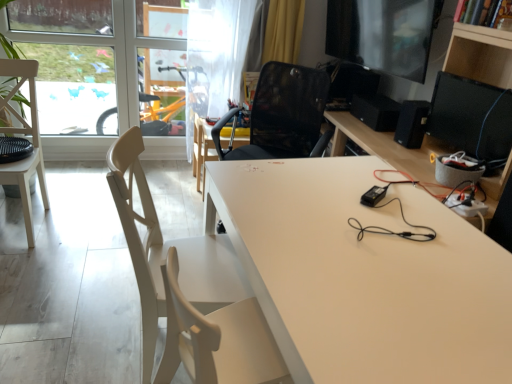
At what (x,y) coordinates should I click in order to perform the action: click on white matte table at center, the 2th table from the back. Please return your answer as a coordinate pair (x, y). Looking at the image, I should click on (364, 275).

Image resolution: width=512 pixels, height=384 pixels. Find the location of `white wood chair at left, positioned as the 2th chair in front-to-back order`. white wood chair at left, positioned as the 2th chair in front-to-back order is located at coordinates (25, 134).

Measure the distance between point (503, 131) and camera.

Point (503, 131) and camera are 6.45 feet apart from each other.

Describe the element at coordinates (383, 34) in the screenshot. I see `matte black monitor at upper right, acting as the first computer monitor starting from the top` at that location.

At what (x,y) coordinates should I click in order to perform the action: click on matte black monitor at upper right, the second computer monitor positioned from the bottom. Please return your answer as a coordinate pair (x, y). The image size is (512, 384). Looking at the image, I should click on (383, 34).

This screenshot has height=384, width=512. Find the location of `black matte speaker at right, positioned as the 1th speaker in front-to-back order`. black matte speaker at right, positioned as the 1th speaker in front-to-back order is located at coordinates (412, 123).

The width and height of the screenshot is (512, 384). In order to click on white wood chair at left, acting as the second chair starting from the back in this screenshot , I will do `click(167, 252)`.

What do you see at coordinates (202, 150) in the screenshot? I see `white matte table at center, the second table viewed from the front` at bounding box center [202, 150].

Describe the element at coordinates (74, 87) in the screenshot. I see `transparent glass window at upper left` at that location.

Where is `white matte table at center, the second table when ordered from top to bottom`? The width and height of the screenshot is (512, 384). white matte table at center, the second table when ordered from top to bottom is located at coordinates (364, 275).

From the image's perspective, which one is positioned lower, white matte table at center, which is the 1th table in left-to-right order, or transparent glass window at upper left?

From the image's view, white matte table at center, which is the 1th table in left-to-right order, is below.

Considering the relative positions of white matte table at center, the second table viewed from the front, and transparent glass window at upper left in the image provided, is white matte table at center, the second table viewed from the front, to the left or to the right of transparent glass window at upper left?

From the image, it's evident that white matte table at center, the second table viewed from the front, is to the right of transparent glass window at upper left.

Is point (202, 193) positioned before point (104, 78)?

Yes, it is in front of point (104, 78).

Based on the photo, from their relative heights in the image, would you say white matte table at center, the second table positioned from the right, is taller or shorter than transparent glass window at upper left?

Clearly, white matte table at center, the second table positioned from the right, is shorter compared to transparent glass window at upper left.

How different are the orientations of black glossy monitor at upper right, the 2th computer monitor from the top, and black matte speaker at right, the second speaker when ordered from back to front, in degrees?

They differ by 7.79 degrees in their facing directions.

Image resolution: width=512 pixels, height=384 pixels. I want to click on computer monitor on the right side of black matte speaker at right, the second speaker when ordered from back to front, so click(471, 116).

Are black glossy monitor at upper right, the first computer monitor when ordered from bottom to top, and black matte speaker at right, the second speaker when ordered from back to front, located far from each other?

No, black glossy monitor at upper right, the first computer monitor when ordered from bottom to top, is not far away from black matte speaker at right, the second speaker when ordered from back to front.

From a real-world perspective, is black glossy monitor at upper right, the 2th computer monitor from the top, physically located above or below black matte speaker at right, positioned as the 1th speaker in front-to-back order?

Clearly, from a real-world perspective, black glossy monitor at upper right, the 2th computer monitor from the top, is above black matte speaker at right, positioned as the 1th speaker in front-to-back order.

Considering the relative sizes of transparent glass window at upper left and white wood chair at left, the first chair positioned from the left, in the image provided, is transparent glass window at upper left bigger than white wood chair at left, the first chair positioned from the left,?

Incorrect, transparent glass window at upper left is not larger than white wood chair at left, the first chair positioned from the left.

From a real-world perspective, is transparent glass window at upper left physically below white wood chair at left, the 2th chair from the right?

No, from a real-world perspective, transparent glass window at upper left is not under white wood chair at left, the 2th chair from the right.

Is point (87, 80) closer to camera compared to point (12, 61)?

No, it is not.

Is there a large distance between transparent glass window at upper left and white wood chair at left, positioned as the 2th chair in front-to-back order?

No, transparent glass window at upper left is not far from white wood chair at left, positioned as the 2th chair in front-to-back order.

From a real-world perspective, is transparent glass window at upper left over matte black monitor at upper right, the second computer monitor positioned from the bottom?

Incorrect, from a real-world perspective, transparent glass window at upper left is lower than matte black monitor at upper right, the second computer monitor positioned from the bottom.

Considering the points (70, 108) and (371, 19), which point is behind, point (70, 108) or point (371, 19)?

The point (70, 108) is farther from the camera.

Is transparent glass window at upper left directly adjacent to matte black monitor at upper right, acting as the first computer monitor starting from the top?

No, transparent glass window at upper left is not with matte black monitor at upper right, acting as the first computer monitor starting from the top.

Is transparent glass window at upper left taller than matte black monitor at upper right, the second computer monitor positioned from the bottom?

Yes.

Between point (342, 30) and point (234, 216), which one is positioned in front?

The point (234, 216) is closer to the camera.

Does matte black monitor at upper right, the second computer monitor positioned from the bottom, have a smaller size compared to white matte table at center, the first table positioned from the front?

Yes.

From the image's perspective, which one is positioned lower, matte black monitor at upper right, the second computer monitor positioned from the bottom, or white matte table at center, which is the 1th table in bottom-to-top order?

white matte table at center, which is the 1th table in bottom-to-top order, appears lower in the image.

Is matte black monitor at upper right, acting as the first computer monitor starting from the top, spatially inside white matte table at center, the second table when ordered from top to bottom, or outside of it?

matte black monitor at upper right, acting as the first computer monitor starting from the top, exists outside the volume of white matte table at center, the second table when ordered from top to bottom.

Is black matte speaker at right, the second speaker when ordered from back to front, taller or shorter than transparent glass window at upper left?

Considering their sizes, black matte speaker at right, the second speaker when ordered from back to front, has less height than transparent glass window at upper left.

From the transparent glass window at upper left, count 2nd speaker to the right and point to it. Please provide its 2D coordinates.

[(412, 123)]

Is black matte speaker at right, positioned as the 1th speaker in front-to-back order, turned away from transparent glass window at upper left?

No, black matte speaker at right, positioned as the 1th speaker in front-to-back order, is not facing the opposite direction of transparent glass window at upper left.

From a real-world perspective, which is physically above, black matte speaker at right, positioned as the 1th speaker in front-to-back order, or transparent glass window at upper left?

black matte speaker at right, positioned as the 1th speaker in front-to-back order, is physically above.

Which is behind, point (123, 162) or point (387, 129)?

Point (387, 129)

From the image's perspective, relative to black matte speaker at upper right, the second speaker in the front-to-back sequence, is white wood chair at left, the second chair in the left-to-right sequence, above or below?

Clearly, from the image's perspective, white wood chair at left, the second chair in the left-to-right sequence, is below black matte speaker at upper right, the second speaker in the front-to-back sequence.

Measure the distance between white wood chair at left, the second chair in the left-to-right sequence, and black matte speaker at upper right, the second speaker in the front-to-back sequence.

white wood chair at left, the second chair in the left-to-right sequence, and black matte speaker at upper right, the second speaker in the front-to-back sequence, are 1.63 meters apart.

Is white wood chair at left, acting as the second chair starting from the back, behind black matte speaker at upper right, the second speaker in the front-to-back sequence?

No, it is in front of black matte speaker at upper right, the second speaker in the front-to-back sequence.

Find the location of a particular element. The image size is (512, 384). window screen that is on the left side of white matte table at center, which is counted as the 1th table, starting from the back is located at coordinates (74, 87).

The height and width of the screenshot is (384, 512). Find the location of `the 1st speaker behind the black glossy monitor at upper right, the 2th computer monitor from the top, starting your count from the anchor`. the 1st speaker behind the black glossy monitor at upper right, the 2th computer monitor from the top, starting your count from the anchor is located at coordinates (412, 123).

Looking at the image, which one is located further to transparent glass window at upper left, black matte speaker at right, positioned as the 1th speaker in front-to-back order, or white wood chair at left, positioned as the 2th chair in front-to-back order?

black matte speaker at right, positioned as the 1th speaker in front-to-back order, is further to transparent glass window at upper left.

Consider the image. Which object lies nearer to the anchor point white wood chair at left, positioned as the 2th chair in front-to-back order, matte black monitor at upper right, the second computer monitor positioned from the bottom, or white wood chair at left, acting as the 1th chair starting from the right?

Among the two, white wood chair at left, acting as the 1th chair starting from the right, is located nearer to white wood chair at left, positioned as the 2th chair in front-to-back order.

Considering their positions, is matte black monitor at upper right, acting as the first computer monitor starting from the top, positioned further to white wood chair at left, the first chair positioned from the front, than white matte table at center, the first table positioned from the top?

matte black monitor at upper right, acting as the first computer monitor starting from the top, is positioned further to the anchor white wood chair at left, the first chair positioned from the front.

Considering their positions, is white wood chair at left, the first chair positioned from the left, positioned closer to black matte speaker at upper right, the second speaker in the front-to-back sequence, than transparent glass window at upper left?

transparent glass window at upper left is positioned closer to the anchor black matte speaker at upper right, the second speaker in the front-to-back sequence.

Which object lies further to the anchor point white matte table at center, the first table positioned from the top, transparent glass window at upper left or black glossy monitor at upper right, the first computer monitor when ordered from bottom to top?

black glossy monitor at upper right, the first computer monitor when ordered from bottom to top, is further to white matte table at center, the first table positioned from the top.

Based on their spatial positions, is white wood chair at left, the first chair in the back-to-front sequence, or black matte speaker at upper right, which is the first speaker in back-to-front order, closer to transparent glass window at upper left?

white wood chair at left, the first chair in the back-to-front sequence.

From the image, which object appears to be nearer to matte black monitor at upper right, acting as the first computer monitor starting from the top, black matte speaker at upper right, the second speaker in the front-to-back sequence, or white matte table at center, the second table viewed from the front?

black matte speaker at upper right, the second speaker in the front-to-back sequence, is closer to matte black monitor at upper right, acting as the first computer monitor starting from the top.

Based on the photo, considering their positions, is transparent glass window at upper left positioned further to black matte speaker at right, positioned as the 1th speaker in front-to-back order, than black glossy monitor at upper right, the first computer monitor when ordered from bottom to top?

transparent glass window at upper left.

The width and height of the screenshot is (512, 384). Identify the location of chair between white wood chair at left, the first chair positioned from the left, and black matte speaker at upper right, which is the first speaker in back-to-front order. (167, 252).

In order to click on window screen between white wood chair at left, the first chair positioned from the left, and matte black monitor at upper right, acting as the first computer monitor starting from the top, in the horizontal direction in this screenshot , I will do `click(74, 87)`.

Identify the location of chair between transparent glass window at upper left and black matte speaker at right, the second speaker when ordered from back to front, in the horizontal direction. The width and height of the screenshot is (512, 384). (167, 252).

Find the location of a particular element. The width and height of the screenshot is (512, 384). chair located between transparent glass window at upper left and black glossy monitor at upper right, the first computer monitor when ordered from bottom to top, in the left-right direction is located at coordinates (167, 252).